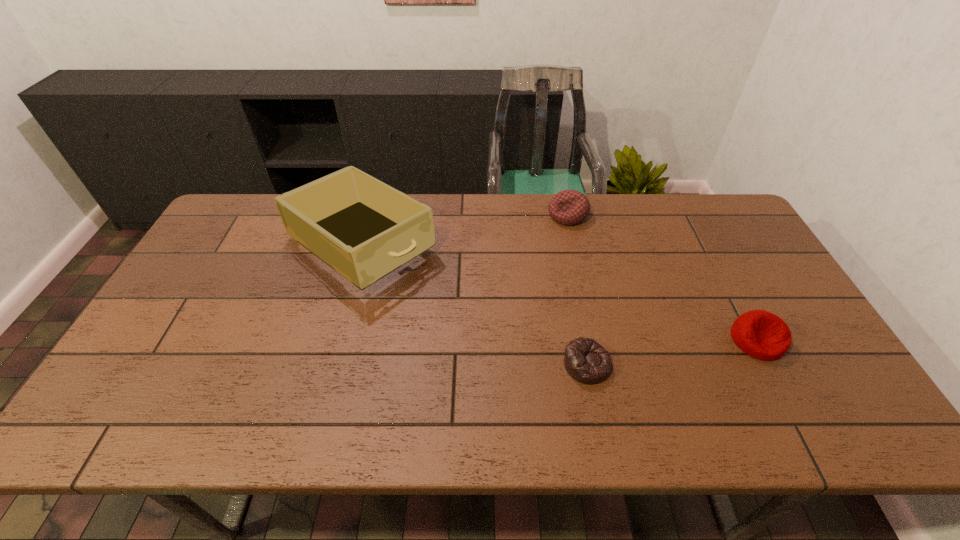
Image resolution: width=960 pixels, height=540 pixels. Identify the location of vacant space in between the box and the farthest beanbag. (465, 230).

You are a GUI agent. You are given a task and a screenshot of the screen. Output one action in this format:
    pyautogui.click(x=<x>, y=<y>)
    Task: Click on the empty location between the leftmost object and the rightmost beanbag
    The height and width of the screenshot is (540, 960).
    Given the screenshot: What is the action you would take?
    pyautogui.click(x=559, y=292)

Where is `vacant space that's between the farthest beanbag and the tallest object`? vacant space that's between the farthest beanbag and the tallest object is located at coordinates (465, 230).

You are a GUI agent. You are given a task and a screenshot of the screen. Output one action in this format:
    pyautogui.click(x=<x>, y=<y>)
    Task: Click on the free space between the rightmost object and the box
    This screenshot has height=540, width=960.
    Given the screenshot: What is the action you would take?
    pyautogui.click(x=559, y=292)

The width and height of the screenshot is (960, 540). Find the location of `vacant region between the shortest beanbag and the rightmost object`. vacant region between the shortest beanbag and the rightmost object is located at coordinates (672, 353).

Locate an element on the screen. The height and width of the screenshot is (540, 960). unoccupied position between the leftmost object and the farthest beanbag is located at coordinates (465, 230).

Where is `free point between the rightmost beanbag and the farthest beanbag`? free point between the rightmost beanbag and the farthest beanbag is located at coordinates (662, 278).

Locate an element on the screen. The height and width of the screenshot is (540, 960). free space between the rightmost object and the shortest beanbag is located at coordinates (672, 353).

Identify which object is located as the nearest to the shortest object. Please provide its 2D coordinates. Your answer should be formatted as a tuple, i.e. [(x, y)], where the tuple contains the x and y coordinates of a point satisfying the conditions above.

[(760, 334)]

Select which object is the closest to the box. Please provide its 2D coordinates. Your answer should be formatted as a tuple, i.e. [(x, y)], where the tuple contains the x and y coordinates of a point satisfying the conditions above.

[(569, 207)]